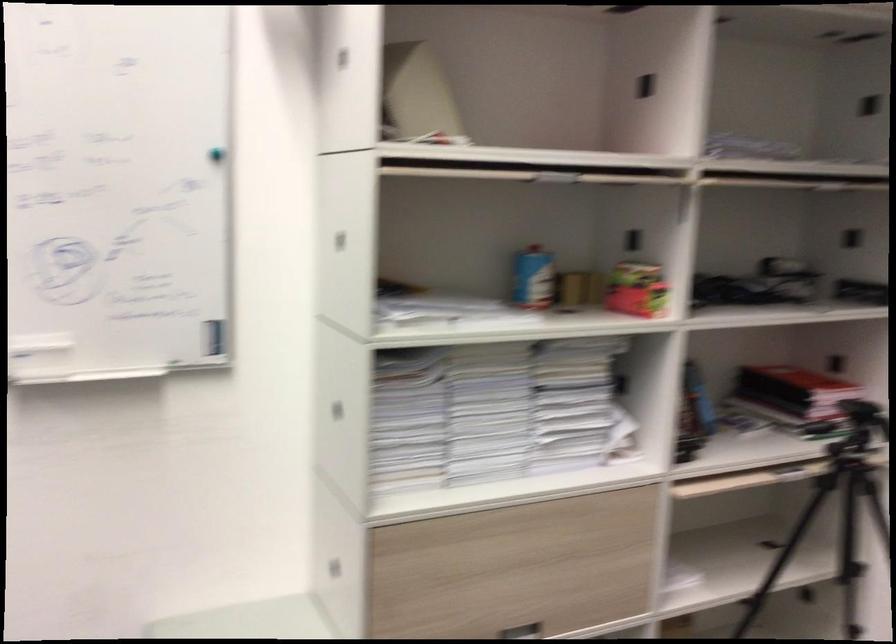
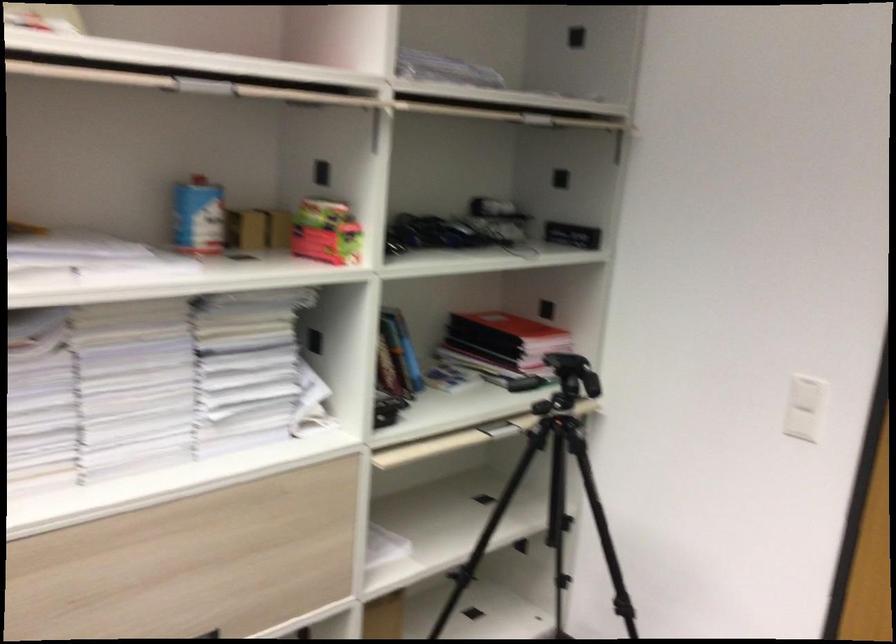
Question: Based on the continuous images, in which direction is the camera rotating? Reply with the corresponding letter.

Choices:
 (A) Left
 (B) Right
 (C) Up
 (D) Down

Answer: (B)